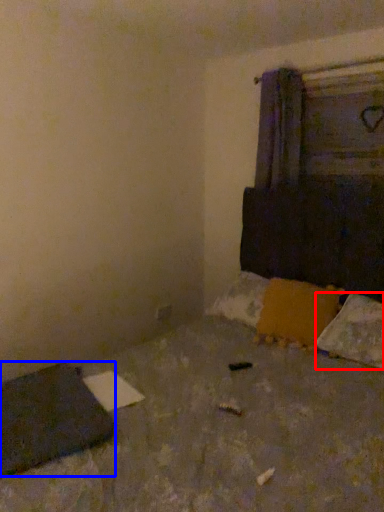
Question: Which object is further to the camera taking this photo, pillow (highlighted by a red box) or pad (highlighted by a blue box)?

Choices:
 (A) pillow
 (B) pad

Answer: (A)